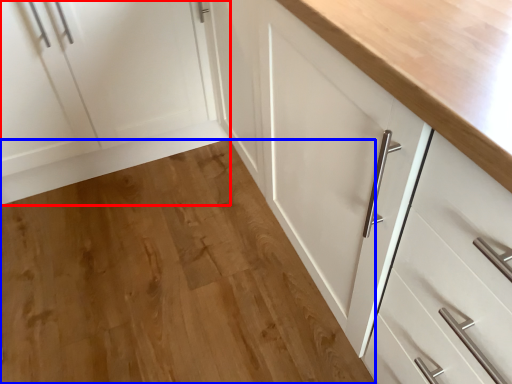
Question: Which object is closer to the camera taking this photo, cabinetry (highlighted by a red box) or hardwood (highlighted by a blue box)?

Choices:
 (A) cabinetry
 (B) hardwood

Answer: (B)